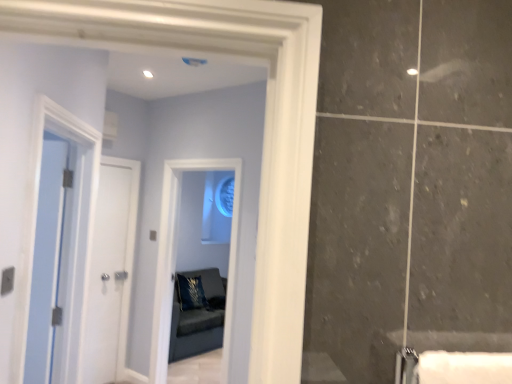
Question: Considering the relative sizes of clear glass mirror at center and blue velvet pillow at center in the image provided, is clear glass mirror at center taller than blue velvet pillow at center?

Choices:
 (A) yes
 (B) no

Answer: (A)

Question: Can you confirm if clear glass mirror at center is wider than blue velvet pillow at center?

Choices:
 (A) yes
 (B) no

Answer: (A)

Question: From the image's perspective, is clear glass mirror at center on blue velvet pillow at center?

Choices:
 (A) yes
 (B) no

Answer: (A)

Question: Can you confirm if clear glass mirror at center is positioned to the left of blue velvet pillow at center?

Choices:
 (A) yes
 (B) no

Answer: (B)

Question: Does clear glass mirror at center have a lesser width compared to blue velvet pillow at center?

Choices:
 (A) no
 (B) yes

Answer: (A)

Question: Is clear glass mirror at center shorter than blue velvet pillow at center?

Choices:
 (A) yes
 (B) no

Answer: (B)

Question: Considering the relative positions of blue glass window at center and blue velvet pillow at center in the image provided, is blue glass window at center to the left of blue velvet pillow at center from the viewer's perspective?

Choices:
 (A) no
 (B) yes

Answer: (A)

Question: Does blue glass window at center have a larger size compared to blue velvet pillow at center?

Choices:
 (A) no
 (B) yes

Answer: (B)

Question: Considering the relative sizes of blue glass window at center and blue velvet pillow at center in the image provided, is blue glass window at center wider than blue velvet pillow at center?

Choices:
 (A) yes
 (B) no

Answer: (B)

Question: Is blue glass window at center shorter than blue velvet pillow at center?

Choices:
 (A) yes
 (B) no

Answer: (B)

Question: Is blue velvet pillow at center located within blue glass window at center?

Choices:
 (A) no
 (B) yes

Answer: (A)

Question: Is blue glass window at center positioned before blue velvet pillow at center?

Choices:
 (A) no
 (B) yes

Answer: (B)

Question: Can you confirm if blue velvet pillow at center is bigger than white glossy door at left, which is counted as the first door, starting from the back?

Choices:
 (A) yes
 (B) no

Answer: (A)